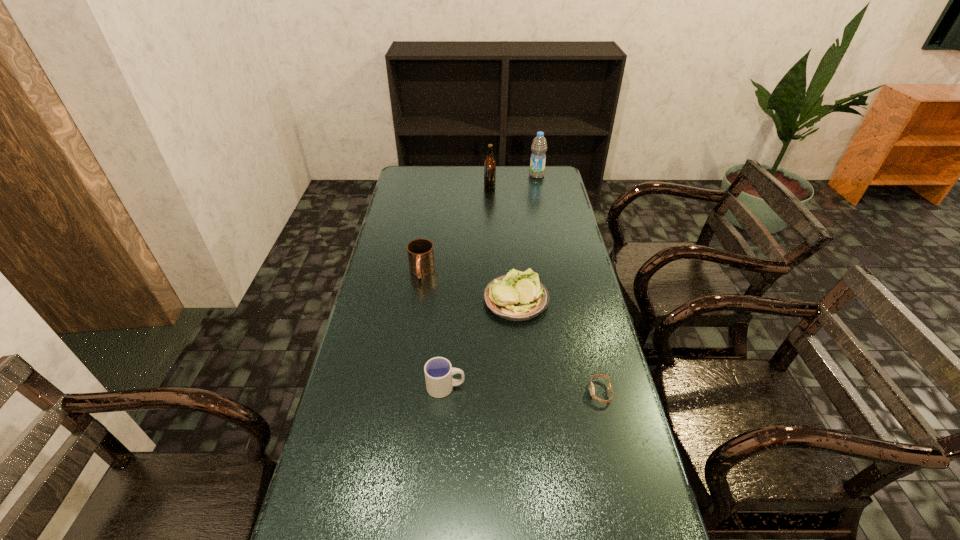
Identify the location of lettuce located in the right edge section of the desktop. (518, 296).

Locate an element on the screen. The image size is (960, 540). watch present at the right edge is located at coordinates (592, 390).

Find the location of a particular element. object at the far right corner is located at coordinates (539, 146).

Where is `free space at the far edge of the desktop`? free space at the far edge of the desktop is located at coordinates (454, 170).

Where is `vacant region at the left edge of the desktop`? The image size is (960, 540). vacant region at the left edge of the desktop is located at coordinates (385, 472).

The image size is (960, 540). What are the coordinates of `free region at the right edge of the desktop` in the screenshot? It's located at (546, 196).

Where is `empty space that is in between the shortest object and the second object from left to right`? empty space that is in between the shortest object and the second object from left to right is located at coordinates (523, 389).

Find the location of a particular element. vacant region between the beer bottle and the mug is located at coordinates (456, 228).

Locate an element on the screen. The height and width of the screenshot is (540, 960). empty space between the cup and the mug is located at coordinates (434, 329).

I want to click on free area in between the shortest object and the mug, so click(x=511, y=332).